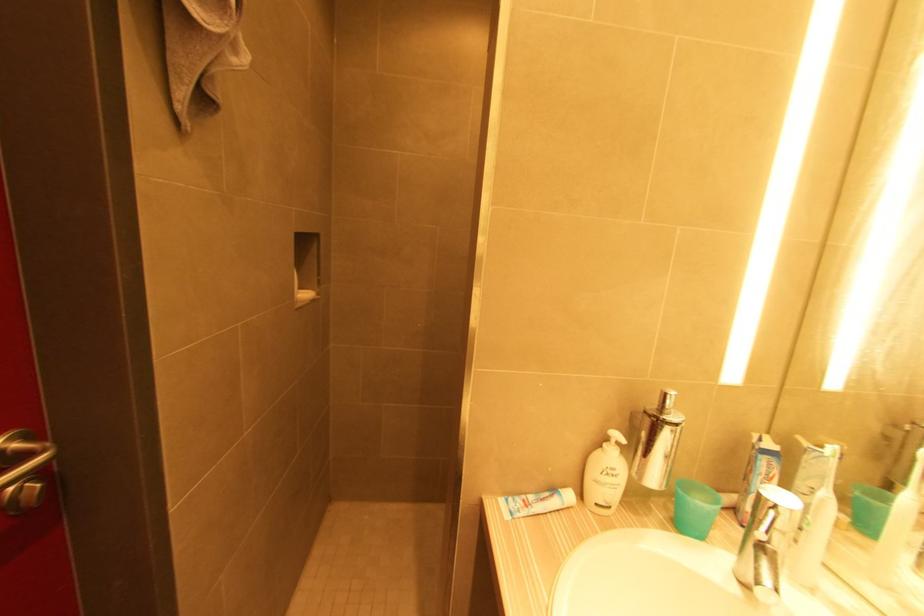
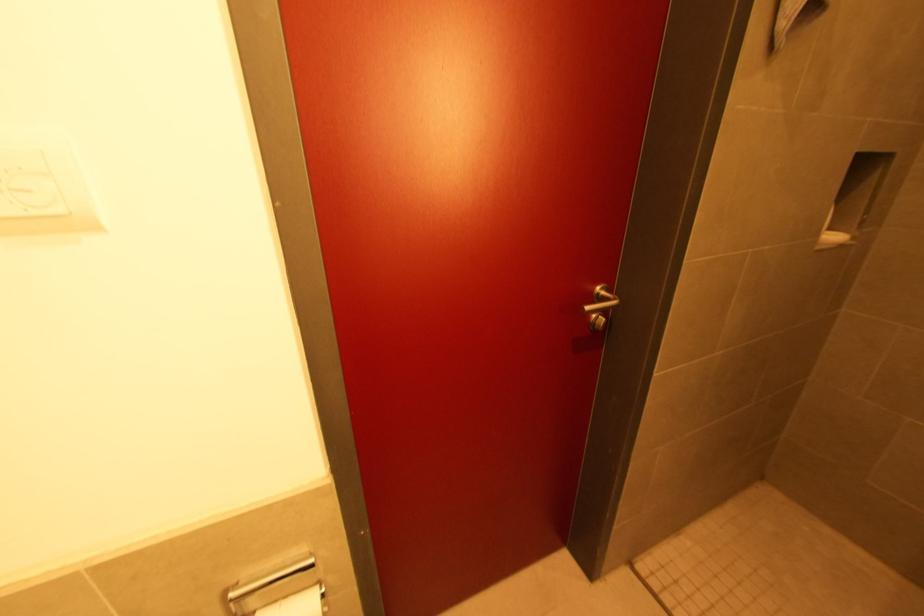
Where in the second image is the point corresponding to (x=41, y=487) from the first image?

(606, 321)